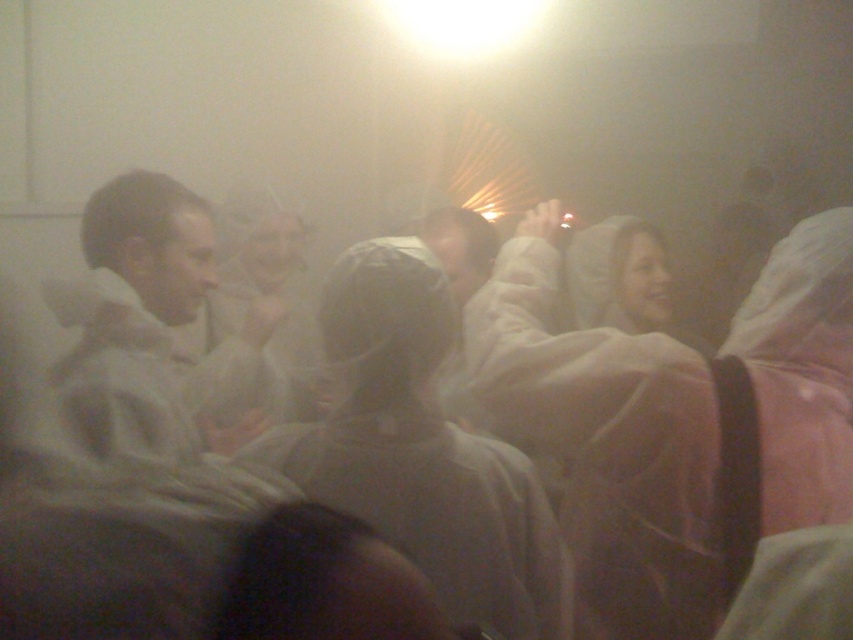
Which of these two, white plastic bag at center or smooth white coat at center, stands shorter?

With less height is smooth white coat at center.

Which is in front, point (300, 433) or point (607, 284)?

Point (300, 433) is more forward.

What are the coordinates of `white plastic bag at center` in the screenshot? It's located at (421, 449).

Is white fabric at center wider than smooth white coat at center?

Yes.

Does white fabric at center appear under smooth white coat at center?

Indeed, white fabric at center is positioned under smooth white coat at center.

Is point (782, 481) farther from camera compared to point (608, 259)?

No, it is in front of (608, 259).

The height and width of the screenshot is (640, 853). What are the coordinates of `white fabric at center` in the screenshot? It's located at click(120, 550).

In the scene shown: Can you confirm if white plastic bag at center is taller than white matte jacket at center?

No.

Can you confirm if white plastic bag at center is positioned to the right of white matte jacket at center?

Indeed, white plastic bag at center is positioned on the right side of white matte jacket at center.

Between point (466, 528) and point (273, 326), which one is positioned behind?

Point (273, 326)

Image resolution: width=853 pixels, height=640 pixels. Find the location of `white plastic bag at center`. white plastic bag at center is located at coordinates (421, 449).